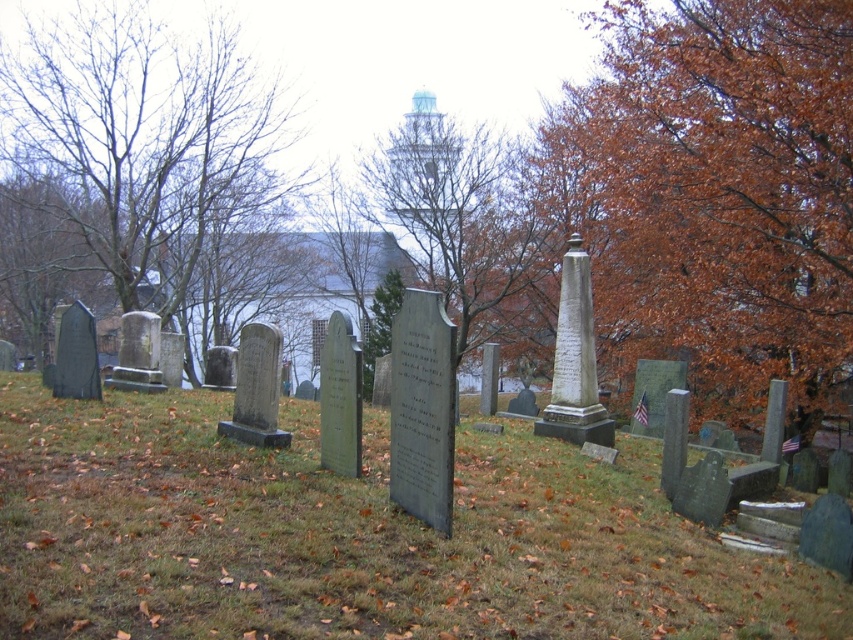
Locate an element on the screen. brown leafy tree at center right is located at coordinates (717, 193).

Does brown leafy tree at center right have a smaller size compared to brown leafy tree at center?

Yes.

The width and height of the screenshot is (853, 640). In order to click on brown leafy tree at center right in this screenshot , I will do [717, 193].

This screenshot has height=640, width=853. What do you see at coordinates (357, 538) in the screenshot?
I see `green grass at center` at bounding box center [357, 538].

Between point (187, 538) and point (120, 122), which one is positioned in front?

Point (187, 538) is more forward.

Where is `green grass at center`? green grass at center is located at coordinates (357, 538).

Between brown leafy tree at center right and bare branches at left, which one appears on the right side from the viewer's perspective?

Positioned to the right is brown leafy tree at center right.

Is point (602, 120) positioned in front of point (155, 180)?

Yes, point (602, 120) is closer to viewer.

At what (x,y) coordinates should I click in order to perform the action: click on brown leafy tree at center right. Please return your answer as a coordinate pair (x, y). The image size is (853, 640). Looking at the image, I should click on (717, 193).